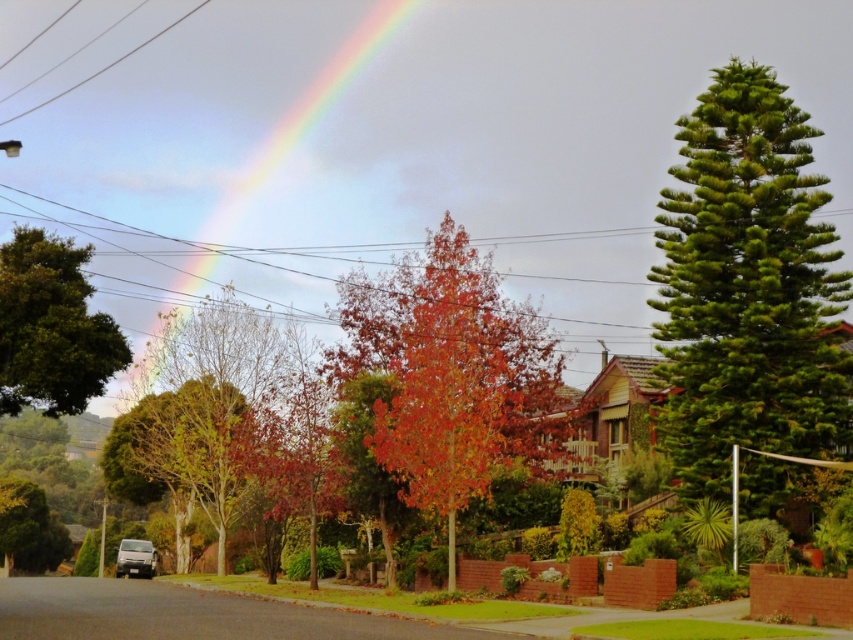
Consider the image. How far apart are shiny red tree at center and green leafy tree at left?

A distance of 15.27 meters exists between shiny red tree at center and green leafy tree at left.

Which is more to the left, shiny red tree at center or green leafy tree at left?

green leafy tree at left

The width and height of the screenshot is (853, 640). What are the coordinates of `shiny red tree at center` in the screenshot? It's located at (451, 378).

Is green needle-like tree at right thinner than shiny red tree at center?

In fact, green needle-like tree at right might be wider than shiny red tree at center.

Is green needle-like tree at right above shiny red tree at center?

Yes, green needle-like tree at right is above shiny red tree at center.

Describe the element at coordinates (746, 285) in the screenshot. This screenshot has height=640, width=853. I see `green needle-like tree at right` at that location.

Identify the location of green needle-like tree at right. The width and height of the screenshot is (853, 640). (746, 285).

Is green leafy tree at left bigger than rainbow at upper center?

Incorrect, green leafy tree at left is not larger than rainbow at upper center.

Which is in front, point (38, 317) or point (397, 4)?

Point (38, 317) is in front.

This screenshot has height=640, width=853. In order to click on green leafy tree at left in this screenshot , I will do `click(51, 326)`.